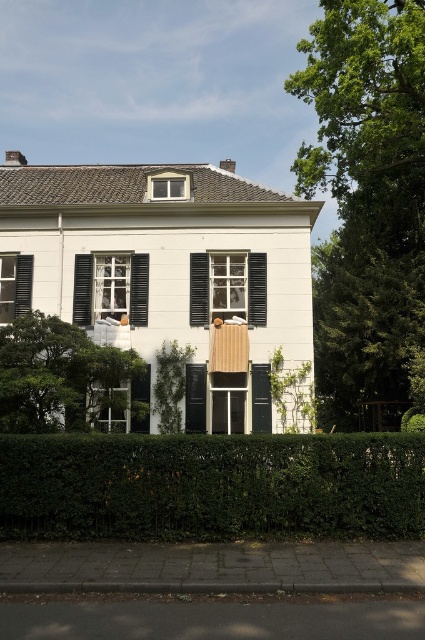
Can you confirm if green leafy tree at upper right is smaller than green leafy bush at lower right?

No, green leafy tree at upper right is not smaller than green leafy bush at lower right.

Does point (413, 317) lie behind point (278, 365)?

Yes, point (413, 317) is behind point (278, 365).

Identify the location of green leafy tree at upper right. Image resolution: width=425 pixels, height=640 pixels. (367, 195).

Does point (376, 64) come behind point (71, 406)?

That is True.

Does green leafy tree at upper right have a larger size compared to green leafy bush at lower left?

Correct, green leafy tree at upper right is larger in size than green leafy bush at lower left.

Describe the element at coordinates (367, 195) in the screenshot. I see `green leafy tree at upper right` at that location.

The height and width of the screenshot is (640, 425). In order to click on green leafy tree at upper right in this screenshot , I will do `click(367, 195)`.

Who is more distant from viewer, (402,481) or (294,394)?

The point (294,394) is behind.

Between green leafy hedge at lower center and green leafy bush at lower right, which one is positioned lower?

green leafy hedge at lower center

The height and width of the screenshot is (640, 425). Identify the location of green leafy hedge at lower center. (210, 486).